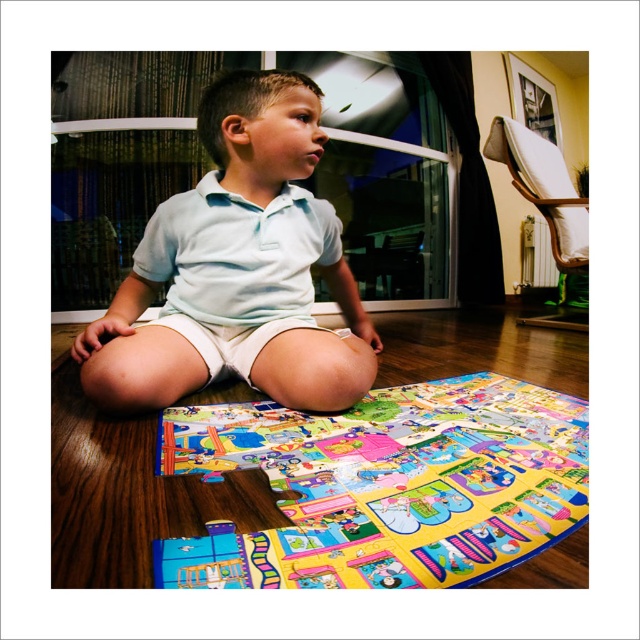
You are a parent trying to clean up the playroom. You need to place the colorful plastic puzzle at lower center and the light blue cotton shirt at center into storage boxes. The puzzle box can only hold items shorter than the shirt. Can you fit both items into the puzzle box?

The colorful plastic puzzle at lower center has a lesser height compared to the light blue cotton shirt at center, so the puzzle can fit into the puzzle box since it is shorter than the shirt. However, the light blue cotton shirt at center cannot be placed in the box because it is taller than the puzzle box limit.

The boy is sitting on the wooden floor and looking at the colorful plastic puzzle at lower center. Where exactly is the puzzle located in relation to the boy?

The colorful plastic puzzle at lower center is located at point (x=387, y=484), which means it is positioned slightly to the right and below the center of the boy, making it easily accessible to him.

You are standing in the room where the boy is playing with the puzzle mat. You want to pick up an object located at point (234, 545). If your hand is 20 inches away from that point, can you reach it?

The point (234, 545) is 20.65 inches away from the viewer. Since your hand is 20 inches away, you can reach it because 20 inches is less than 20.65 inches.